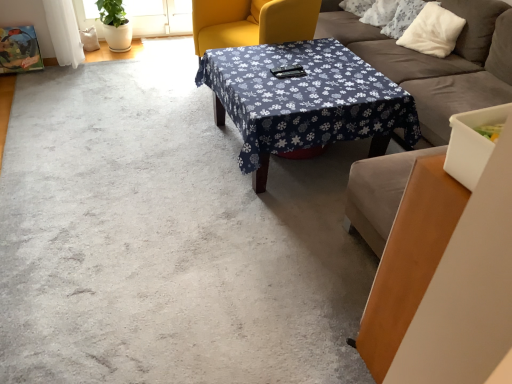
In order to face soft gray fabric couch at center, should I rotate leftwards or rightwards?

Rotate your view right by about 20.581°.

The image size is (512, 384). Describe the element at coordinates (252, 22) in the screenshot. I see `matte yellow swivel chair at center` at that location.

Where is `soft gray fabric couch at center`? This screenshot has height=384, width=512. soft gray fabric couch at center is located at coordinates (439, 62).

Considering the positions of objects matte yellow swivel chair at center and soft gray fabric couch at center in the image provided, who is in front, matte yellow swivel chair at center or soft gray fabric couch at center?

soft gray fabric couch at center is closer to the camera.

In the image, is matte yellow swivel chair at center on the left side or the right side of soft gray fabric couch at center?

In the image, matte yellow swivel chair at center appears on the left side of soft gray fabric couch at center.

Is point (218, 110) positioned after point (385, 49)?

No, (218, 110) is in front of (385, 49).

From a real-world perspective, who is located lower, matte yellow swivel chair at center or soft gray fabric couch at center?

matte yellow swivel chair at center.

Who is taller, soft gray fabric couch at center or white fluffy pillow at upper right?

soft gray fabric couch at center is taller.

Considering the relative sizes of soft gray fabric couch at center and white fluffy pillow at upper right in the image provided, is soft gray fabric couch at center wider than white fluffy pillow at upper right?

Correct, the width of soft gray fabric couch at center exceeds that of white fluffy pillow at upper right.

In the scene shown: Is soft gray fabric couch at center to the left of white fluffy pillow at upper right from the viewer's perspective?

Indeed, soft gray fabric couch at center is positioned on the left side of white fluffy pillow at upper right.

From a real-world perspective, between soft gray fabric couch at center and white fluffy pillow at upper right, who is vertically higher?

white fluffy pillow at upper right.

From the picture: Is blue fabric-covered table at center located outside white fluffy pillow at upper right?

Absolutely, blue fabric-covered table at center is external to white fluffy pillow at upper right.

Is blue fabric-covered table at center with white fluffy pillow at upper right?

No, blue fabric-covered table at center is not in contact with white fluffy pillow at upper right.

From a real-world perspective, is blue fabric-covered table at center physically located above or below white fluffy pillow at upper right?

blue fabric-covered table at center is below white fluffy pillow at upper right.

Is blue fabric-covered table at center bigger than white fluffy pillow at upper right?

Indeed, blue fabric-covered table at center has a larger size compared to white fluffy pillow at upper right.

Is blue fabric-covered table at center bigger or smaller than soft gray fabric couch at center?

blue fabric-covered table at center is smaller than soft gray fabric couch at center.

Which is more to the left, blue fabric-covered table at center or soft gray fabric couch at center?

blue fabric-covered table at center is more to the left.

From the image's perspective, which one is positioned higher, blue fabric-covered table at center or soft gray fabric couch at center?

From the image's view, soft gray fabric couch at center is above.

From a real-world perspective, does white fluffy pillow at upper right stand above blue fabric-covered table at center?

Indeed, from a real-world perspective, white fluffy pillow at upper right stands above blue fabric-covered table at center.

Is blue fabric-covered table at center a part of white fluffy pillow at upper right?

No, blue fabric-covered table at center is not surrounded by white fluffy pillow at upper right.

Is white fluffy pillow at upper right next to blue fabric-covered table at center?

No, white fluffy pillow at upper right is not beside blue fabric-covered table at center.

Which is more to the right, white fluffy pillow at upper right or blue fabric-covered table at center?

white fluffy pillow at upper right is more to the right.

From the image's perspective, is matte yellow swivel chair at center above white fluffy pillow at upper right?

Indeed, from the image's perspective, matte yellow swivel chair at center is shown above white fluffy pillow at upper right.

Considering the relative sizes of matte yellow swivel chair at center and white fluffy pillow at upper right in the image provided, is matte yellow swivel chair at center bigger than white fluffy pillow at upper right?

Indeed, matte yellow swivel chair at center has a larger size compared to white fluffy pillow at upper right.

Which of these two, matte yellow swivel chair at center or white fluffy pillow at upper right, stands taller?

matte yellow swivel chair at center is taller.

The height and width of the screenshot is (384, 512). I want to click on swivel chair above the white fluffy pillow at upper right (from the image's perspective), so click(x=252, y=22).

Between matte yellow swivel chair at center and blue fabric-covered table at center, which one is positioned behind?

matte yellow swivel chair at center is further away from the camera.

Which object is positioned more to the right, matte yellow swivel chair at center or blue fabric-covered table at center?

Positioned to the right is blue fabric-covered table at center.

Does point (261, 35) come closer to viewer compared to point (259, 120)?

That is False.

What's the angular difference between matte yellow swivel chair at center and blue fabric-covered table at center's facing directions?

The angular difference between matte yellow swivel chair at center and blue fabric-covered table at center is 29.1 degrees.

Where is `swivel chair that is above the soft gray fabric couch at center (from the image's perspective)`? This screenshot has width=512, height=384. swivel chair that is above the soft gray fabric couch at center (from the image's perspective) is located at coordinates (252, 22).

This screenshot has height=384, width=512. I want to click on studio couch that appears in front of the white fluffy pillow at upper right, so click(439, 62).

Looking at this image, looking at the image, which one is located further to soft gray fabric couch at center, matte yellow swivel chair at center or white fluffy pillow at upper right?

Among the two, matte yellow swivel chair at center is located further to soft gray fabric couch at center.

From the picture: Considering their positions, is blue fabric-covered table at center positioned closer to soft gray fabric couch at center than white fluffy pillow at upper right?

white fluffy pillow at upper right is positioned closer to the anchor soft gray fabric couch at center.

Looking at the image, which one is located further to blue fabric-covered table at center, white fluffy pillow at upper right or soft gray fabric couch at center?

The object further to blue fabric-covered table at center is white fluffy pillow at upper right.

Estimate the real-world distances between objects in this image. Which object is closer to matte yellow swivel chair at center, blue fabric-covered table at center or white fluffy pillow at upper right?

blue fabric-covered table at center lies closer to matte yellow swivel chair at center than the other object.

From the image, which object appears to be farther from white fluffy pillow at upper right, blue fabric-covered table at center or matte yellow swivel chair at center?

blue fabric-covered table at center.

Considering their positions, is matte yellow swivel chair at center positioned closer to blue fabric-covered table at center than soft gray fabric couch at center?

The object closer to blue fabric-covered table at center is soft gray fabric couch at center.

Consider the image. Which object lies further to the anchor point white fluffy pillow at upper right, blue fabric-covered table at center or soft gray fabric couch at center?

blue fabric-covered table at center is positioned further to the anchor white fluffy pillow at upper right.

Looking at the image, which one is located further to matte yellow swivel chair at center, white fluffy pillow at upper right or soft gray fabric couch at center?

white fluffy pillow at upper right is positioned further to the anchor matte yellow swivel chair at center.

You are a GUI agent. You are given a task and a screenshot of the screen. Output one action in this format:
    pyautogui.click(x=<x>, y=<y>)
    Task: Click on the coffee table between matte yellow swivel chair at center and white fluffy pillow at upper right in the horizontal direction
    Image resolution: width=512 pixels, height=384 pixels.
    Given the screenshot: What is the action you would take?
    [303, 100]

At what (x,y) coordinates should I click in order to perform the action: click on studio couch between matte yellow swivel chair at center and white fluffy pillow at upper right. Please return your answer as a coordinate pair (x, y). The height and width of the screenshot is (384, 512). Looking at the image, I should click on (x=439, y=62).

Where is `studio couch situated between blue fabric-covered table at center and white fluffy pillow at upper right from left to right`? The height and width of the screenshot is (384, 512). studio couch situated between blue fabric-covered table at center and white fluffy pillow at upper right from left to right is located at coordinates pyautogui.click(x=439, y=62).

Find the location of `coffee table between matte yellow swivel chair at center and soft gray fabric couch at center from left to right`. coffee table between matte yellow swivel chair at center and soft gray fabric couch at center from left to right is located at coordinates (303, 100).